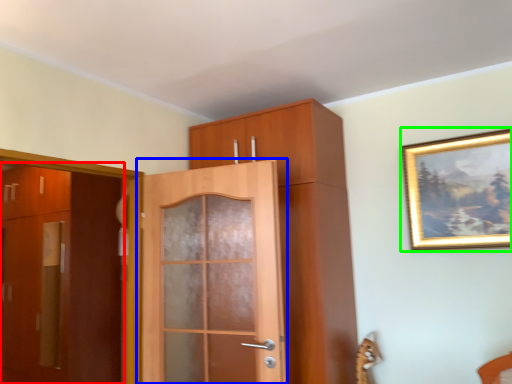
Question: Which is nearer to the door (highlighted by a red box)? door (highlighted by a blue box) or picture frame (highlighted by a green box).

Choices:
 (A) door
 (B) picture frame

Answer: (A)